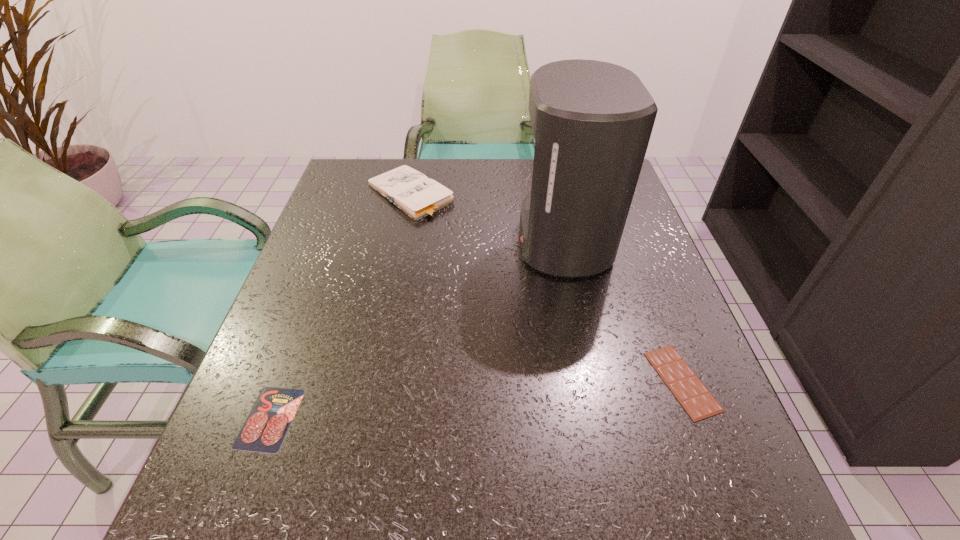
Image resolution: width=960 pixels, height=540 pixels. Find the location of `vacant space at the right edge of the desktop`. vacant space at the right edge of the desktop is located at coordinates (619, 385).

Where is `blank area at the far left corner`? blank area at the far left corner is located at coordinates (350, 193).

This screenshot has height=540, width=960. Identify the location of free space at the near left corner of the desktop. (261, 501).

Where is `vacant region at the near right corner`? This screenshot has height=540, width=960. vacant region at the near right corner is located at coordinates (691, 481).

Where is `empty space that is in between the tallest object and the chocolate bar`? empty space that is in between the tallest object and the chocolate bar is located at coordinates (622, 310).

The height and width of the screenshot is (540, 960). Find the location of `vacant area that lies between the salami and the coffee maker`. vacant area that lies between the salami and the coffee maker is located at coordinates (417, 329).

You are a GUI agent. You are given a task and a screenshot of the screen. Output one action in this format:
    pyautogui.click(x=<x>, y=<y>)
    Task: Click on the free space between the tallest object and the notebook
    The height and width of the screenshot is (540, 960).
    Given the screenshot: What is the action you would take?
    pyautogui.click(x=486, y=217)

You are a GUI agent. You are given a task and a screenshot of the screen. Output one action in this format:
    pyautogui.click(x=<x>, y=<y>)
    Task: Click on the free space between the salami and the third shortest object
    
    Given the screenshot: What is the action you would take?
    pyautogui.click(x=340, y=306)

Identify the location of empty location between the notebook and the chocolate bar. (546, 288).

At what (x,y) coordinates should I click in order to perform the action: click on vacant area that lies between the notebook and the salami. Please return your answer as a coordinate pair (x, y). Looking at the image, I should click on (340, 306).